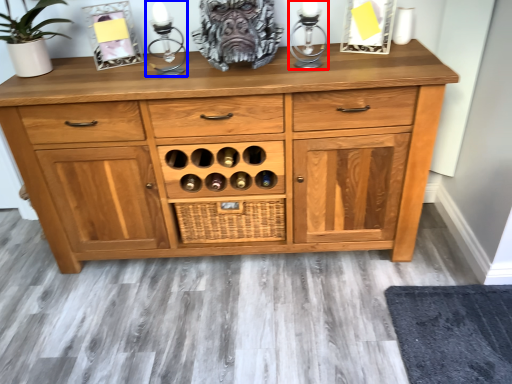
Question: Among these objects, which one is farthest to the camera, candle holder (highlighted by a red box) or candle holder (highlighted by a blue box)?

Choices:
 (A) candle holder
 (B) candle holder

Answer: (B)